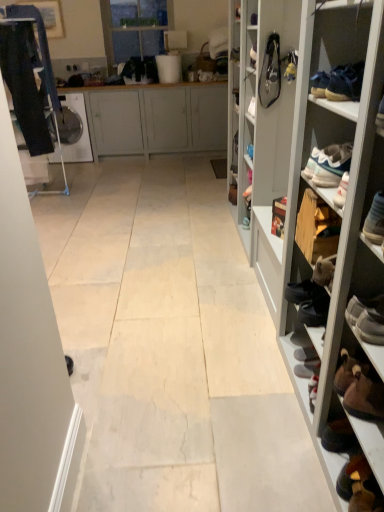
Question: Is leather bag at upper right, acting as the first shoe starting from the left, spatially inside transparent glass door at upper center, or outside of it?

Choices:
 (A) inside
 (B) outside

Answer: (B)

Question: In terms of width, does leather bag at upper right, acting as the first shoe starting from the left, look wider or thinner when compared to transparent glass door at upper center?

Choices:
 (A) thin
 (B) wide

Answer: (A)

Question: Considering the real-world distances, which object is closest to the matte gray cabinet at center?

Choices:
 (A) yellow fabric shoe at upper right, the second shoe in the left-to-right sequence
 (B) transparent glass door at upper center
 (C) leather bag at upper right, acting as the first shoe starting from the left
 (D) dark blue jeans at left
 (E) wooden shoe rack at right

Answer: (B)

Question: Which object is positioned farthest from the matte gray cabinet at center?

Choices:
 (A) dark blue jeans at left
 (B) transparent glass door at upper center
 (C) leather bag at upper right, acting as the first shoe starting from the left
 (D) wooden shoe rack at right
 (E) yellow fabric shoe at upper right, the second shoe in the left-to-right sequence

Answer: (D)